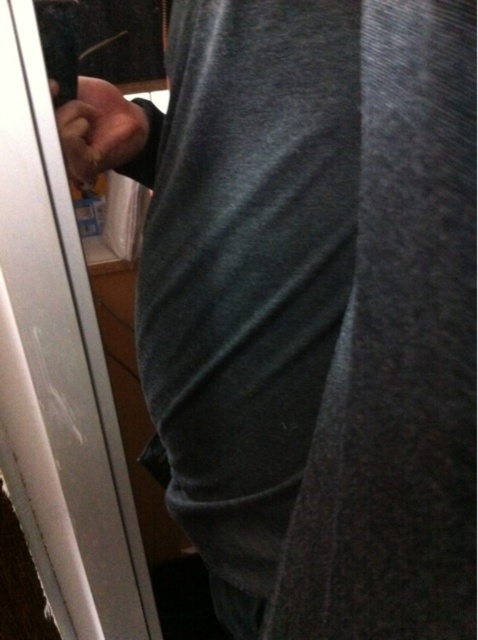
Question: Is white glossy door at left wider than smooth skin hand at upper left?

Choices:
 (A) yes
 (B) no

Answer: (A)

Question: Which point is closer to the camera?

Choices:
 (A) (43, 460)
 (B) (122, 148)

Answer: (B)

Question: Which point is farther to the camera?

Choices:
 (A) 32,536
 (B) 106,134

Answer: (A)

Question: Observing the image, what is the correct spatial positioning of white glossy door at left in reference to smooth skin hand at upper left?

Choices:
 (A) right
 (B) left

Answer: (B)

Question: Can you confirm if white glossy door at left is bigger than smooth skin hand at upper left?

Choices:
 (A) no
 (B) yes

Answer: (B)

Question: Which point is closer to the camera taking this photo?

Choices:
 (A) (40, 435)
 (B) (137, 116)

Answer: (B)